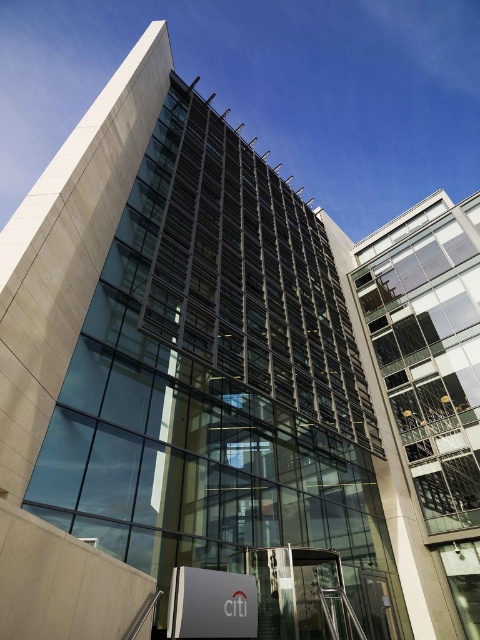
From the picture: Does clear glass building at right have a greater height compared to metallic staircase at lower center?

Indeed, clear glass building at right has a greater height compared to metallic staircase at lower center.

Find the location of a particular element. The width and height of the screenshot is (480, 640). clear glass building at right is located at coordinates (429, 348).

Who is more distant from viewer, (x=444, y=525) or (x=263, y=637)?

The point (x=444, y=525) is more distant.

Find the location of a particular element. The height and width of the screenshot is (640, 480). clear glass building at right is located at coordinates (429, 348).